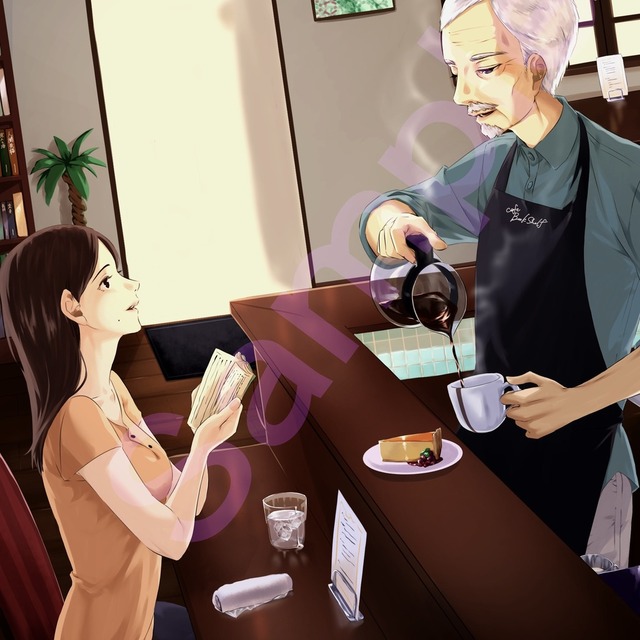
At what (x,y) coordinates should I click in order to perform the action: click on countertop. Please return your answer as a coordinate pair (x, y). This screenshot has width=640, height=640. Looking at the image, I should click on (310, 396).